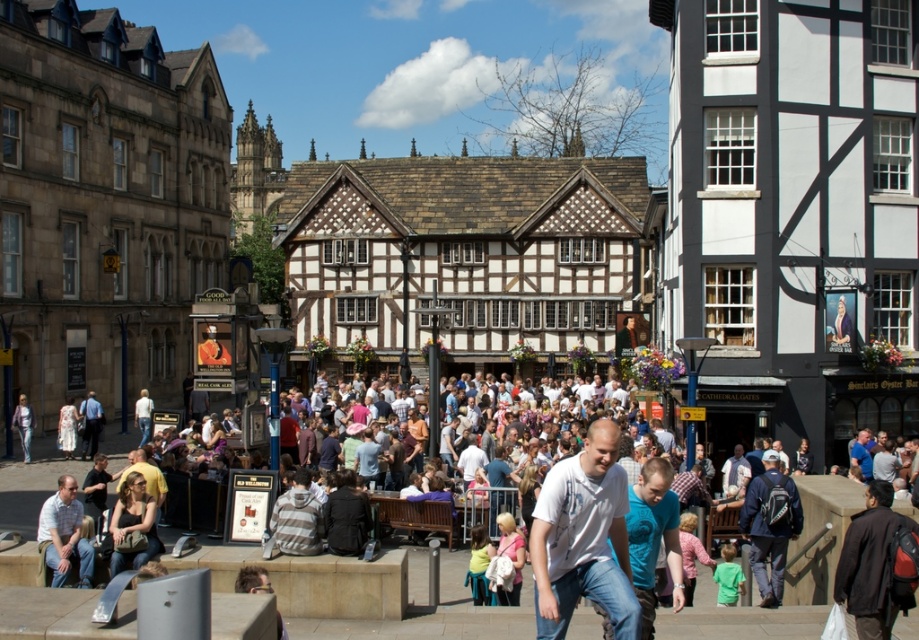
Looking at this image, does dark blue backpack at center have a lesser width compared to light brown leather jacket at lower left?

Indeed, dark blue backpack at center has a lesser width compared to light brown leather jacket at lower left.

Consider the image. Can you confirm if dark blue backpack at center is positioned above light brown leather jacket at lower left?

No.

This screenshot has width=919, height=640. I want to click on dark blue backpack at center, so click(769, 528).

Can you confirm if multicolored casual attire at center is thinner than light brown leather jacket at lower left?

No.

Can you confirm if multicolored casual attire at center is shorter than light brown leather jacket at lower left?

No, multicolored casual attire at center is not shorter than light brown leather jacket at lower left.

At what (x,y) coordinates should I click in order to perform the action: click on multicolored casual attire at center. Please return your answer as a coordinate pair (x, y). This screenshot has width=919, height=640. Looking at the image, I should click on (422, 616).

Does white t-shirt at center have a greater height compared to striped hoodie at center?

Yes.

Which is behind, point (603, 477) or point (293, 532)?

The point (293, 532) is behind.

Locate an element on the screen. white t-shirt at center is located at coordinates (583, 538).